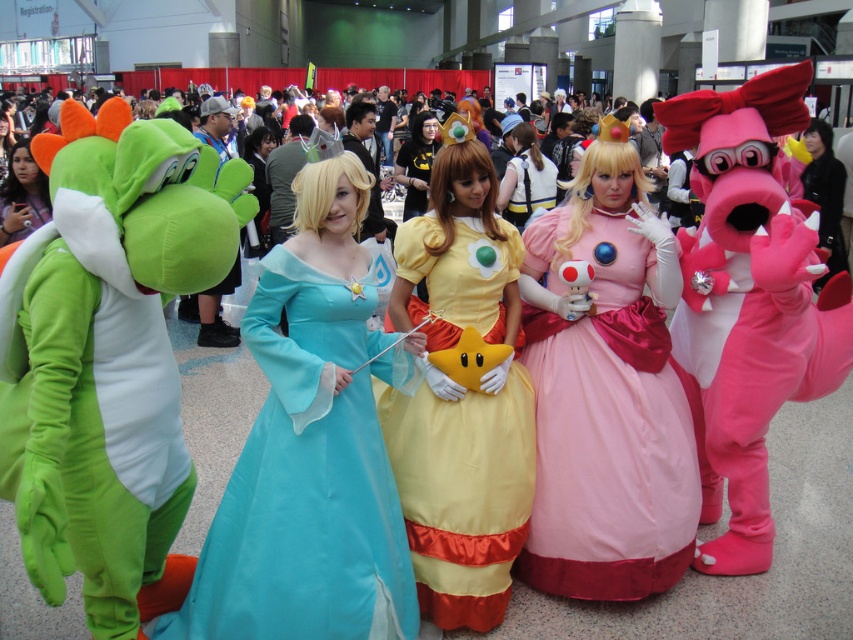
Can you confirm if yellow satin dress at center is smaller than light brown fabric dress at center?

Yes, yellow satin dress at center is smaller than light brown fabric dress at center.

Is yellow satin dress at center above light brown fabric dress at center?

Actually, yellow satin dress at center is below light brown fabric dress at center.

Locate an element on the screen. This screenshot has height=640, width=853. yellow satin dress at center is located at coordinates (461, 394).

Where is `yellow satin dress at center`? This screenshot has width=853, height=640. yellow satin dress at center is located at coordinates [x=461, y=394].

Is yellow satin dress at center shorter than matte green costume at left?

Incorrect, yellow satin dress at center's height does not fall short of matte green costume at left's.

Is yellow satin dress at center positioned in front of matte green costume at left?

Yes, it is in front of matte green costume at left.

Describe the element at coordinates (461, 394) in the screenshot. I see `yellow satin dress at center` at that location.

The width and height of the screenshot is (853, 640). Identify the location of yellow satin dress at center. (461, 394).

Consider the image. Can you confirm if matte blue dress at center is positioned below yellow satin dress at center?

Correct, matte blue dress at center is located below yellow satin dress at center.

Between point (270, 401) and point (451, 390), which one is positioned behind?

The point (451, 390) is behind.

You are a GUI agent. You are given a task and a screenshot of the screen. Output one action in this format:
    pyautogui.click(x=<x>, y=<y>)
    Task: Click on the matte blue dress at center
    
    Given the screenshot: What is the action you would take?
    pyautogui.click(x=310, y=449)